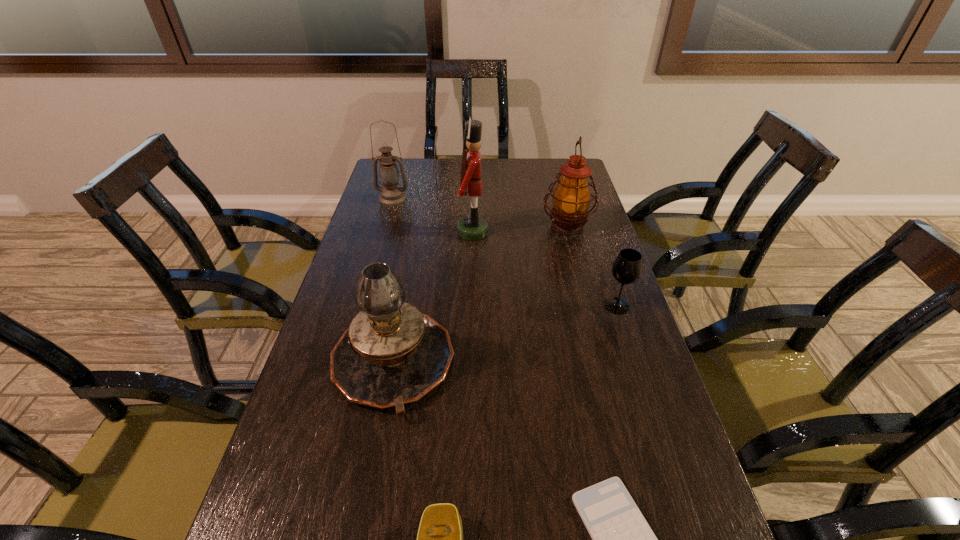
This screenshot has width=960, height=540. I want to click on free spot between the farthest object and the tallest object, so click(x=433, y=215).

Select which object is the closest to the third shortest object. Please provide its 2D coordinates. Your answer should be formatted as a tuple, i.e. [(x, y)], where the tuple contains the x and y coordinates of a point satisfying the conditions above.

[(571, 198)]

Identify which object is located as the third nearest to the third shortest object. Please provide its 2D coordinates. Your answer should be formatted as a tuple, i.e. [(x, y)], where the tuple contains the x and y coordinates of a point satisfying the conditions above.

[(472, 227)]

Identify which oil lamp is the nearest to the second nearest oil lamp. Please provide its 2D coordinates. Your answer should be formatted as a tuple, i.e. [(x, y)], where the tuple contains the x and y coordinates of a point satisfying the conditions above.

[(391, 354)]

Select which oil lamp appears as the second closest to the clutch bag. Please provide its 2D coordinates. Your answer should be formatted as a tuple, i.e. [(x, y)], where the tuple contains the x and y coordinates of a point satisfying the conditions above.

[(571, 198)]